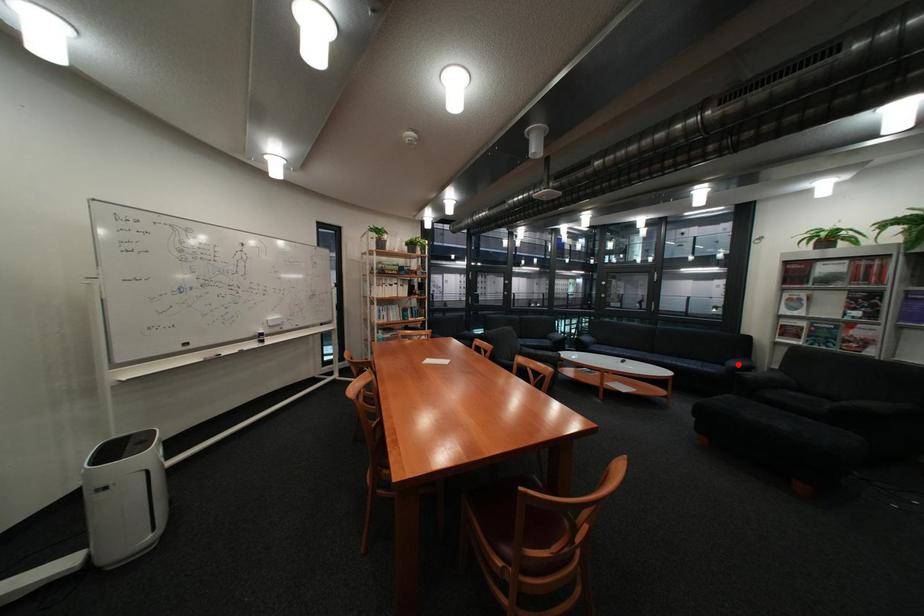
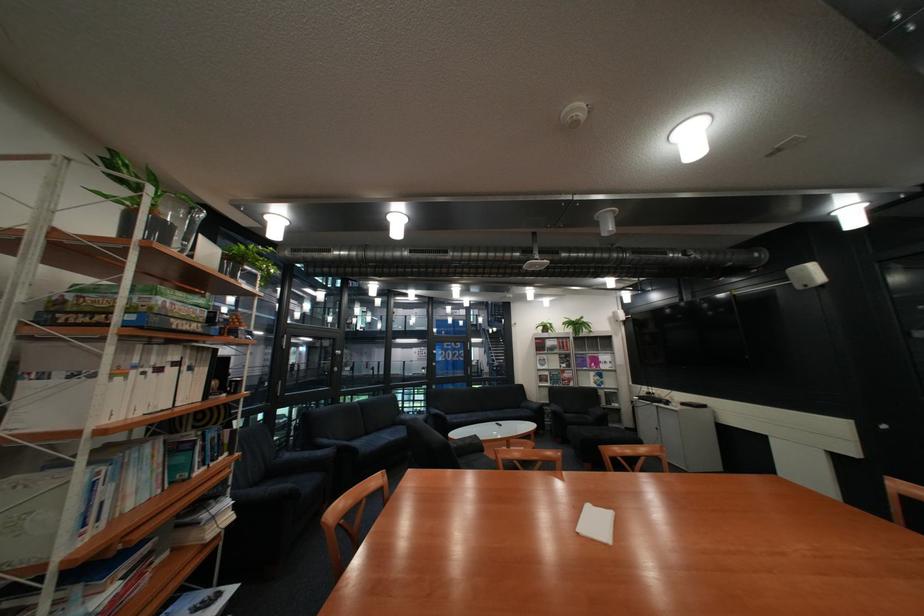
Question: I am providing you with two images of the same scene from different viewpoints. In image1, a red point is highlighted. Considering the same 3D point in image2, which of the following is correct?

Choices:
 (A) It is closer
 (B) It is farther

Answer: (B)